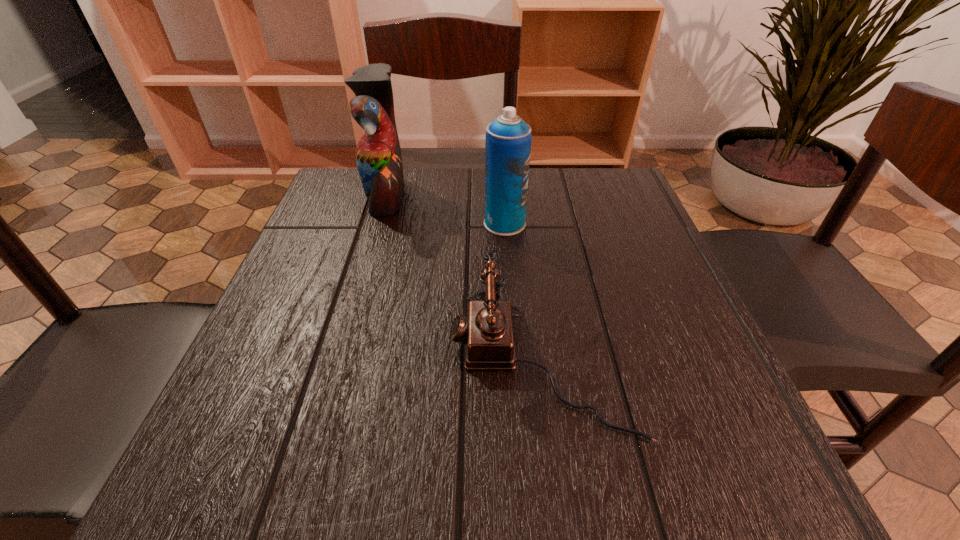
Image resolution: width=960 pixels, height=540 pixels. What are the coordinates of `vacant space at the far right corner` in the screenshot? It's located at (x=586, y=174).

The image size is (960, 540). What are the coordinates of `blank space at the near right corner of the desktop` in the screenshot? It's located at (773, 482).

The width and height of the screenshot is (960, 540). In order to click on vacant area between the leftmost object and the telephone in this screenshot , I will do `click(463, 277)`.

The width and height of the screenshot is (960, 540). In order to click on empty space between the telephone and the aerosol can in this screenshot , I will do `click(521, 292)`.

Locate an element on the screen. This screenshot has width=960, height=540. unoccupied area between the aerosol can and the parrot is located at coordinates (445, 210).

You are a GUI agent. You are given a task and a screenshot of the screen. Output one action in this format:
    pyautogui.click(x=<x>, y=<y>)
    Task: Click on the empty space between the parrot and the aerosol can
    Image resolution: width=960 pixels, height=540 pixels.
    Given the screenshot: What is the action you would take?
    pyautogui.click(x=445, y=210)

Find the location of a particular element. vacant point located between the aerosol can and the shortest object is located at coordinates (521, 292).

Identify the location of free point between the shortest object and the aerosol can. (521, 292).

Find the location of a particular element. The width and height of the screenshot is (960, 540). vacant area that lies between the aerosol can and the shortest object is located at coordinates (521, 292).

You are a GUI agent. You are given a task and a screenshot of the screen. Output one action in this format:
    pyautogui.click(x=<x>, y=<y>)
    Task: Click on the empty space between the aerosol can and the nearest object
    This screenshot has height=540, width=960.
    Given the screenshot: What is the action you would take?
    pyautogui.click(x=521, y=292)